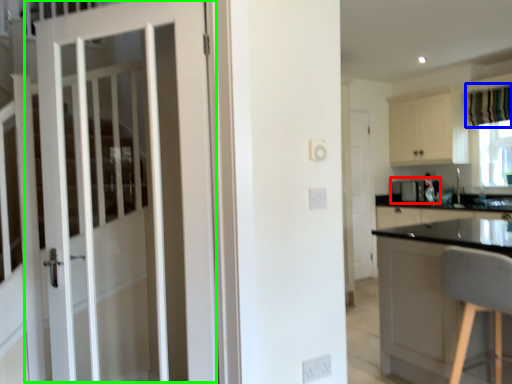
Question: Considering the real-world distances, which object is farthest from appliance (highlighted by a red box)? curtain (highlighted by a blue box) or door (highlighted by a green box)?

Choices:
 (A) curtain
 (B) door

Answer: (B)